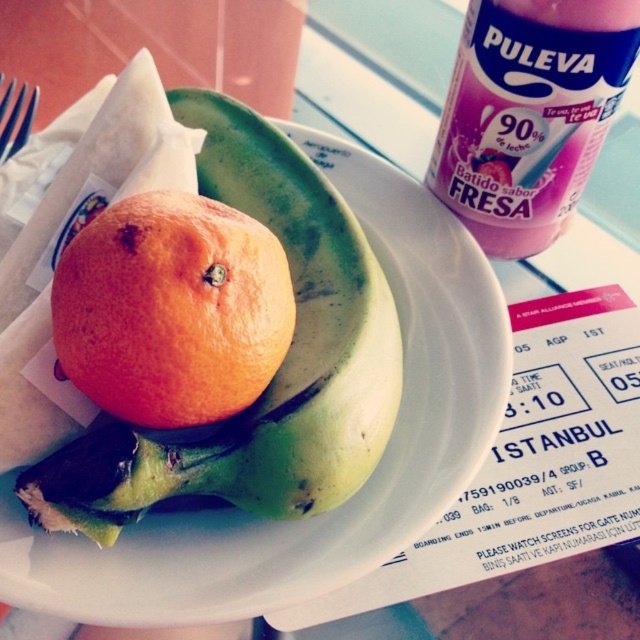
You are a chef preparing a fruit platter and need to know the relative sizes of the items on the table. Which object is bigger between the orangesmoothobject at center and the blue plastic fork at upper left?

The orangesmoothobject at center is larger than the blue plastic fork at upper left.

You are arranging fruits on a table and need to place the orangesmoothobject at center and the green matte banana at center. According to the image, which fruit is positioned closer to you?

The green matte banana at center is closer to you because the orangesmoothobject at center is behind it.

You are a person with a height of 165 cm standing at the edge of the table where the pink can of Puleva Batido sabor Fresa is located. The point at coordinates point (x=147, y=280) is where you want to place a small sticker. Can you reach that point without moving your position?

The point at coordinates point (x=147, y=280) is 99.73 centimeters away from you. Since the average arm length for a person of 165 cm height is approximately 70 cm, you cannot reach the point at coordinates point (x=147, y=280) without moving your position.